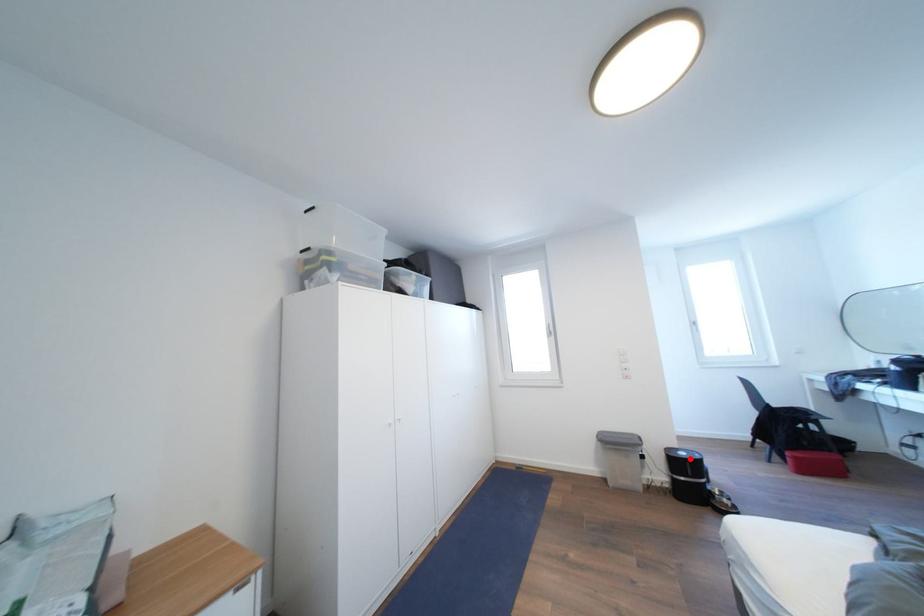
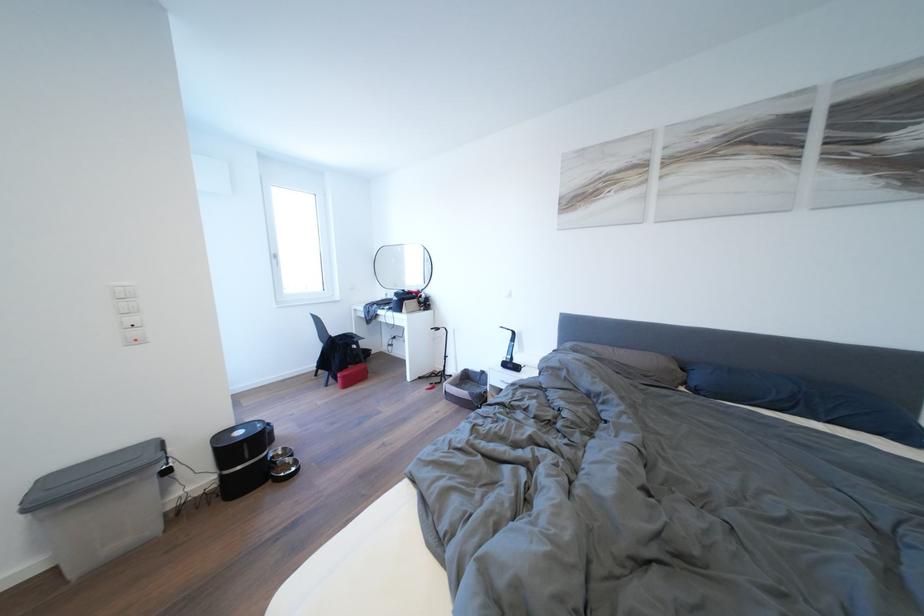
The point at the highlighted location is marked in the first image. Where is the corresponding point in the second image?

(248, 438)